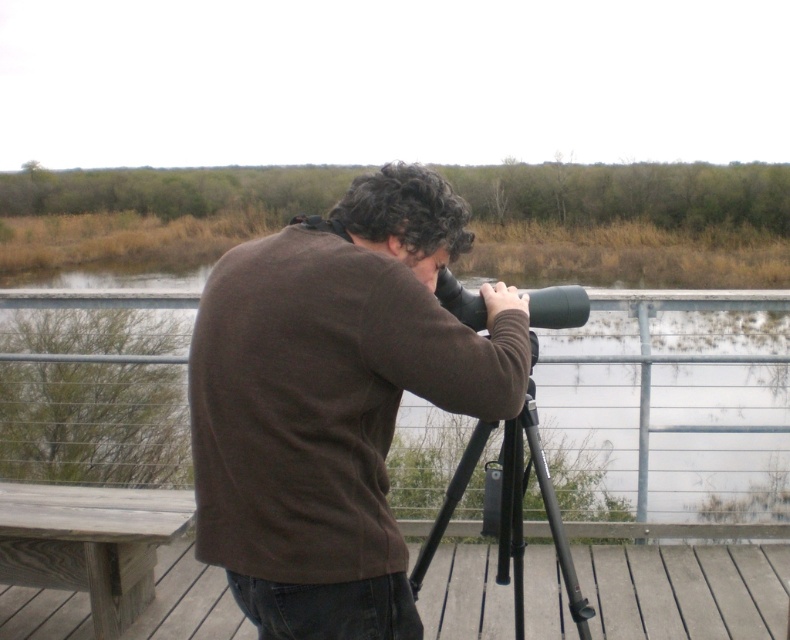
Question: Which object is positioned closest to the black matte tripod at center?

Choices:
 (A) brown matte sweater at center
 (B) clear water at center
 (C) black rubber binoculars at center

Answer: (C)

Question: Does brown matte sweater at center appear over clear water at center?

Choices:
 (A) no
 (B) yes

Answer: (A)

Question: Which object appears closest to the camera in this image?

Choices:
 (A) black rubber binoculars at center
 (B) black matte tripod at center
 (C) wooden at lower left
 (D) brown matte sweater at center

Answer: (D)

Question: Which point is closer to the camera?

Choices:
 (A) brown matte sweater at center
 (B) black rubber binoculars at center
 (C) clear water at center
 (D) black matte tripod at center

Answer: (A)

Question: Does wooden at lower left appear over black rubber binoculars at center?

Choices:
 (A) no
 (B) yes

Answer: (A)

Question: Is wooden at lower left to the right of black matte tripod at center from the viewer's perspective?

Choices:
 (A) no
 (B) yes

Answer: (B)